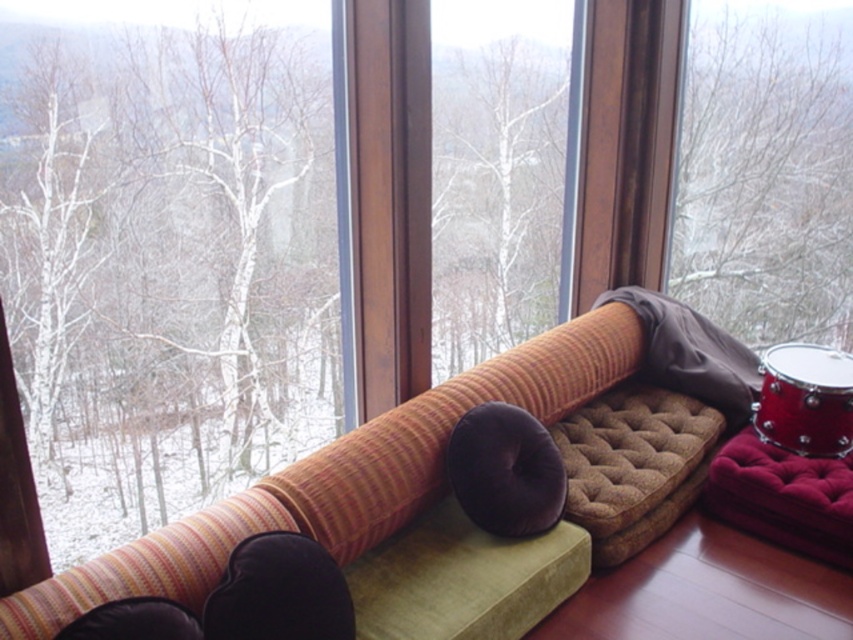
Can you confirm if striped fabric couch at center is bigger than shiny red drum at lower right?

Correct, striped fabric couch at center is larger in size than shiny red drum at lower right.

Is striped fabric couch at center shorter than shiny red drum at lower right?

In fact, striped fabric couch at center may be taller than shiny red drum at lower right.

The width and height of the screenshot is (853, 640). I want to click on striped fabric couch at center, so 402,456.

Does velvet maroon stool at lower right have a lesser width compared to velvet brown pillow at center?

No, velvet maroon stool at lower right is not thinner than velvet brown pillow at center.

The image size is (853, 640). I want to click on velvet maroon stool at lower right, so click(x=782, y=497).

The height and width of the screenshot is (640, 853). Identify the location of velvet maroon stool at lower right. (782, 497).

Consider the image. Does velvet maroon stool at lower right appear under shiny red drum at lower right?

Indeed, velvet maroon stool at lower right is positioned under shiny red drum at lower right.

In the scene shown: Is velvet maroon stool at lower right taller than shiny red drum at lower right?

No, velvet maroon stool at lower right is not taller than shiny red drum at lower right.

Who is more forward, (834, 518) or (808, 388)?

Point (834, 518)

Where is `velvet maroon stool at lower right`? This screenshot has width=853, height=640. velvet maroon stool at lower right is located at coordinates click(x=782, y=497).